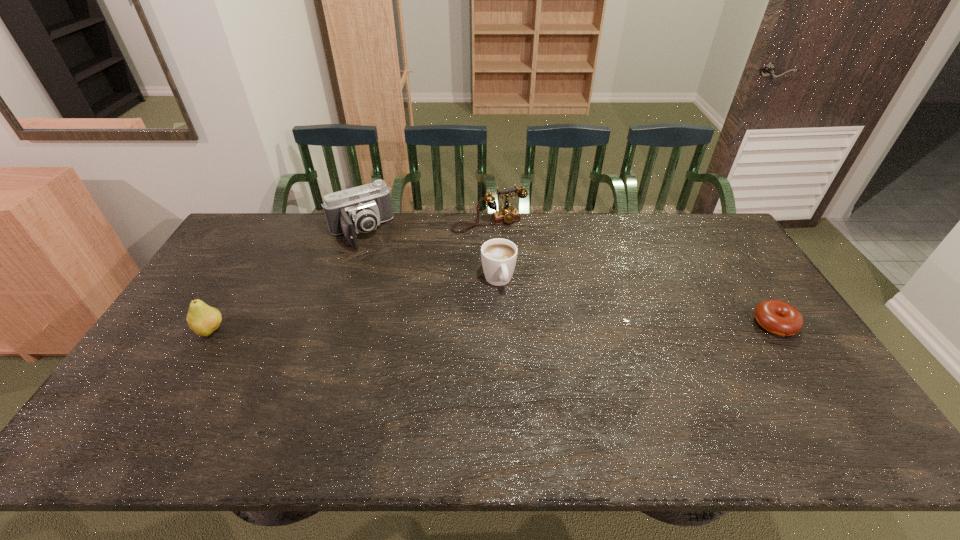
Find the location of `the leftmost object`. the leftmost object is located at coordinates (203, 319).

The height and width of the screenshot is (540, 960). What are the coordinates of `the shortest object` in the screenshot? It's located at (777, 317).

This screenshot has height=540, width=960. Find the location of `doughnut`. doughnut is located at coordinates (777, 317).

This screenshot has height=540, width=960. In order to click on telephone in this screenshot , I will do `click(506, 214)`.

This screenshot has width=960, height=540. What are the coordinates of `cappuccino` in the screenshot? It's located at (498, 256).

Where is `the second shortest object`? This screenshot has width=960, height=540. the second shortest object is located at coordinates (498, 256).

Where is `the second object from left to right`? Image resolution: width=960 pixels, height=540 pixels. the second object from left to right is located at coordinates click(x=360, y=209).

Find the location of `free location located 0.190m on the right of the leftmost object`. free location located 0.190m on the right of the leftmost object is located at coordinates (293, 330).

What are the coordinates of `vacant region located 0.150m on the back of the shortest object` in the screenshot? It's located at (742, 275).

Identify the location of free space located 0.180m on the front-facing side of the telephone. This screenshot has width=960, height=540. (519, 264).